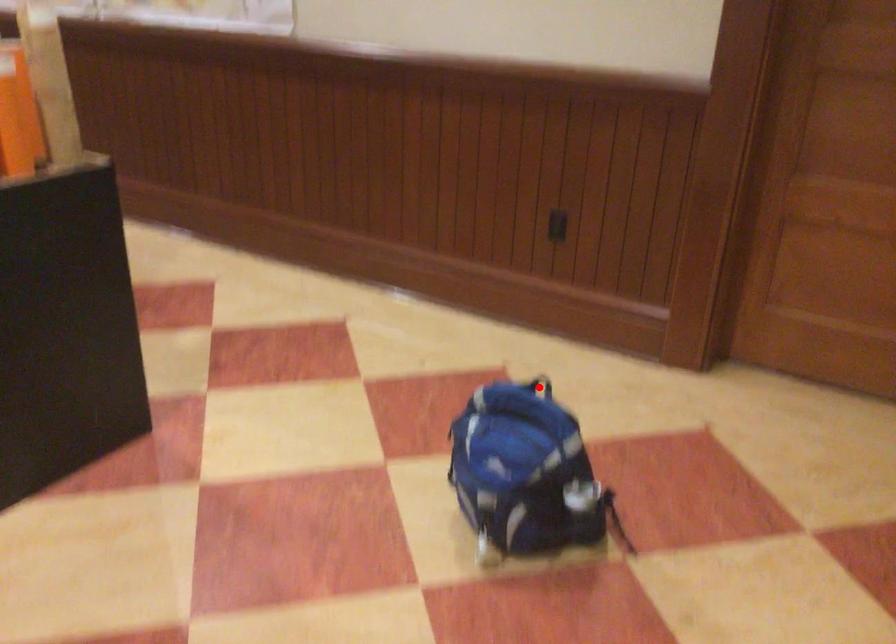
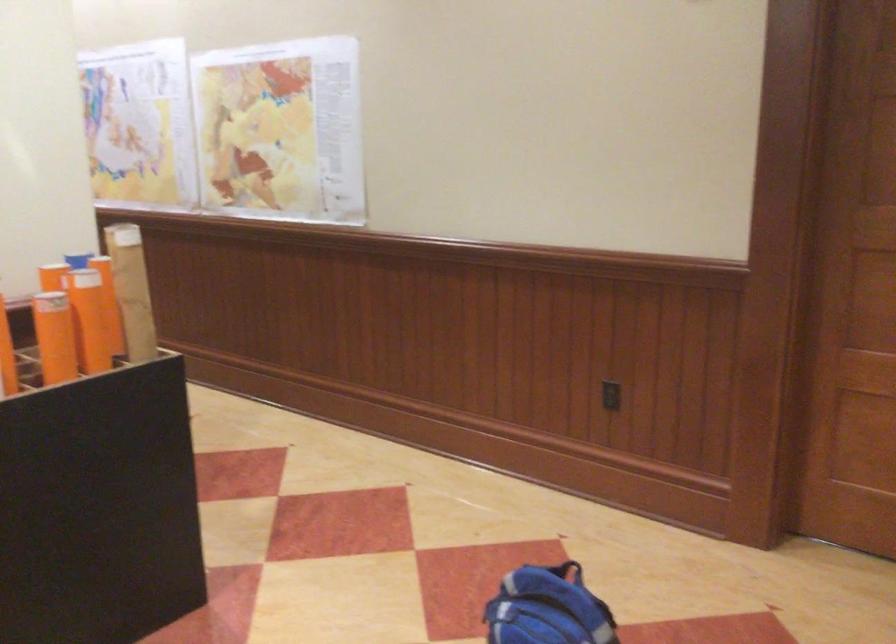
Find the pixel in the second image that matches the highlighted location in the first image.

(567, 571)